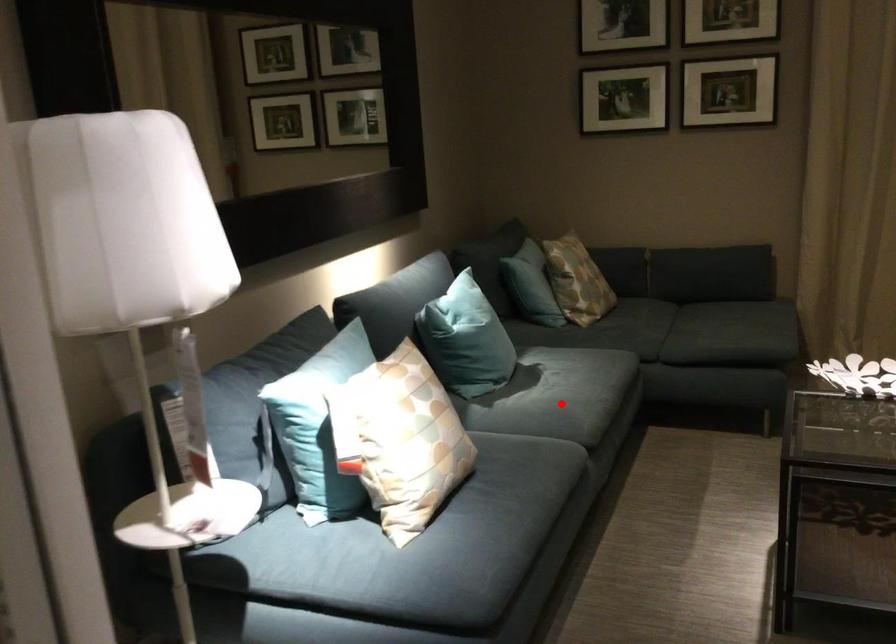
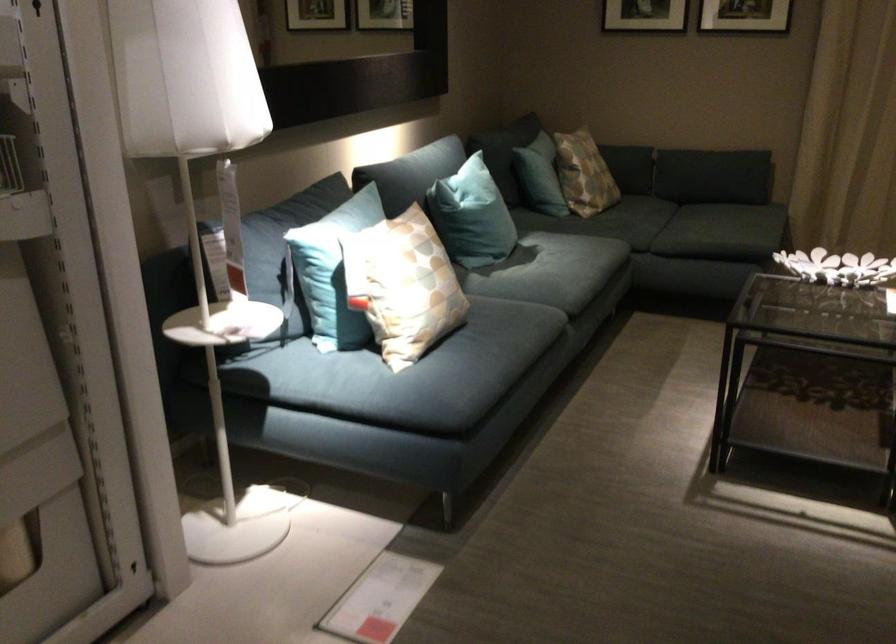
Locate, in the second image, the point that corresponds to the highlighted location in the first image.

(552, 275)